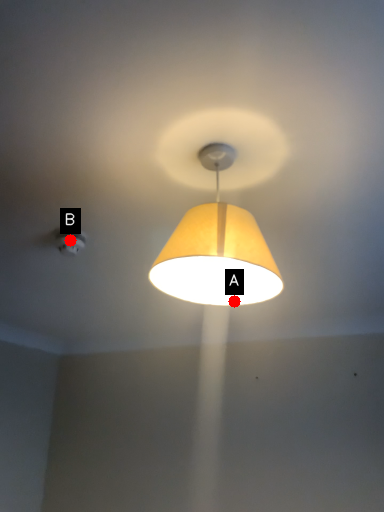
Question: Two points are circled on the image, labeled by A and B beside each circle. Which of the following is the closest to the observer?

Choices:
 (A) A is closer
 (B) B is closer

Answer: (A)